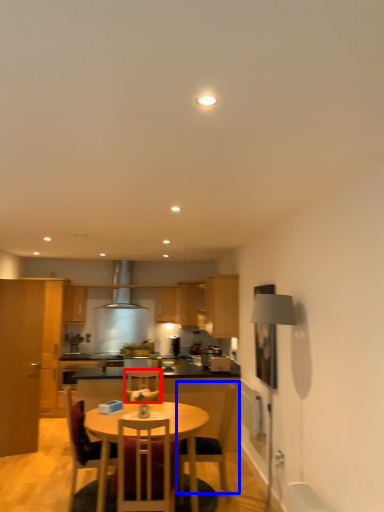
Question: Which of the following is the farthest to the observer, chair (highlighted by a red box) or chair (highlighted by a blue box)?

Choices:
 (A) chair
 (B) chair

Answer: (A)